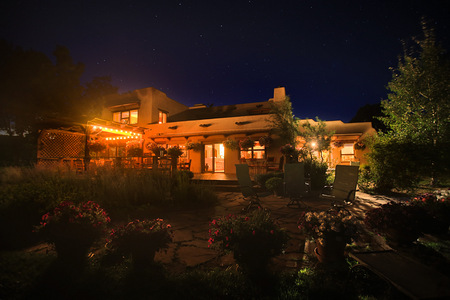
This screenshot has height=300, width=450. I want to click on window, so click(134, 117).